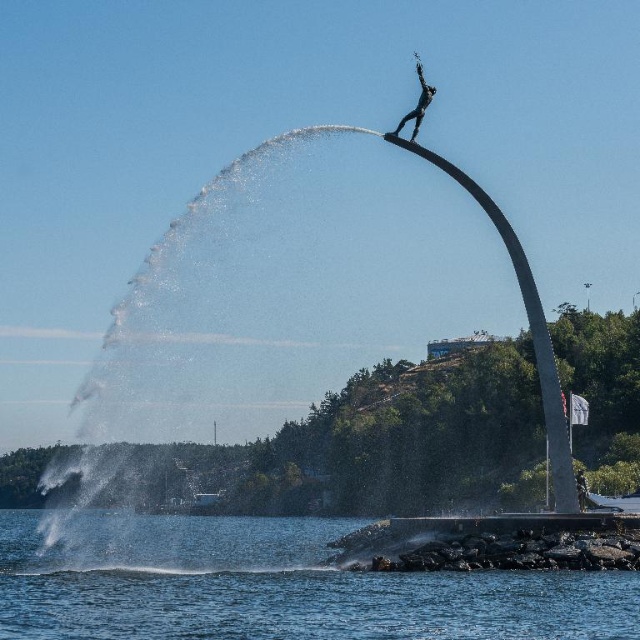
Does clear water at lower center have a lesser width compared to metallic silver statue at center?

No.

Can you confirm if clear water at lower center is bigger than metallic silver statue at center?

Correct, clear water at lower center is larger in size than metallic silver statue at center.

I want to click on clear water at lower center, so click(x=272, y=586).

Can you confirm if clear water at lower center is positioned above polished bronze statue at upper center?

No.

Is clear water at lower center behind polished bronze statue at upper center?

No.

Locate an element on the screen. This screenshot has height=640, width=640. clear water at lower center is located at coordinates (272, 586).

How much distance is there between polished bronze statue at upper center and metallic silver statue at center?

They are 58.59 meters apart.

Who is more distant from viewer, (422, 81) or (584, 488)?

The point (584, 488) is more distant.

Who is more forward, (435, 90) or (579, 499)?

Point (579, 499) is more forward.

In order to click on polished bronze statue at upper center in this screenshot , I will do `click(417, 102)`.